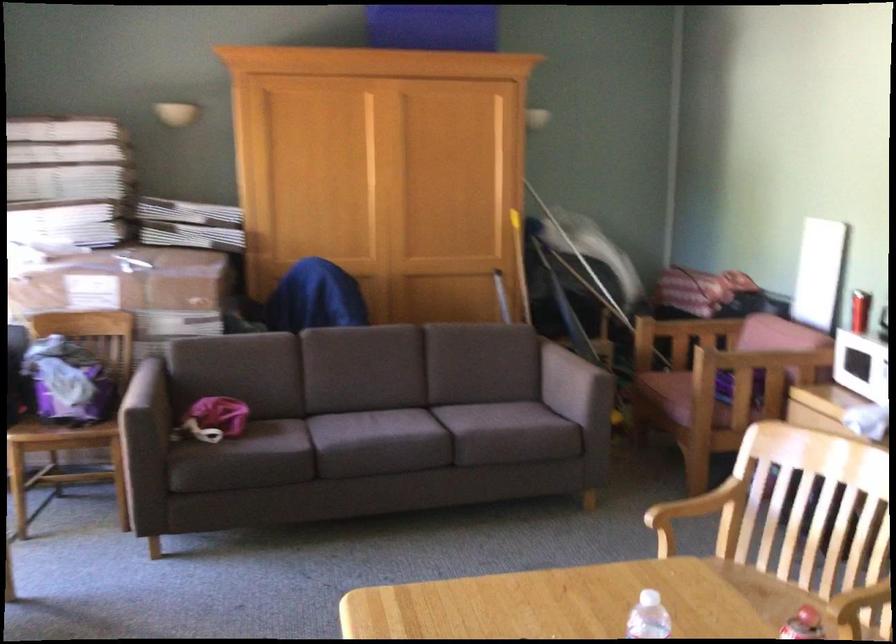
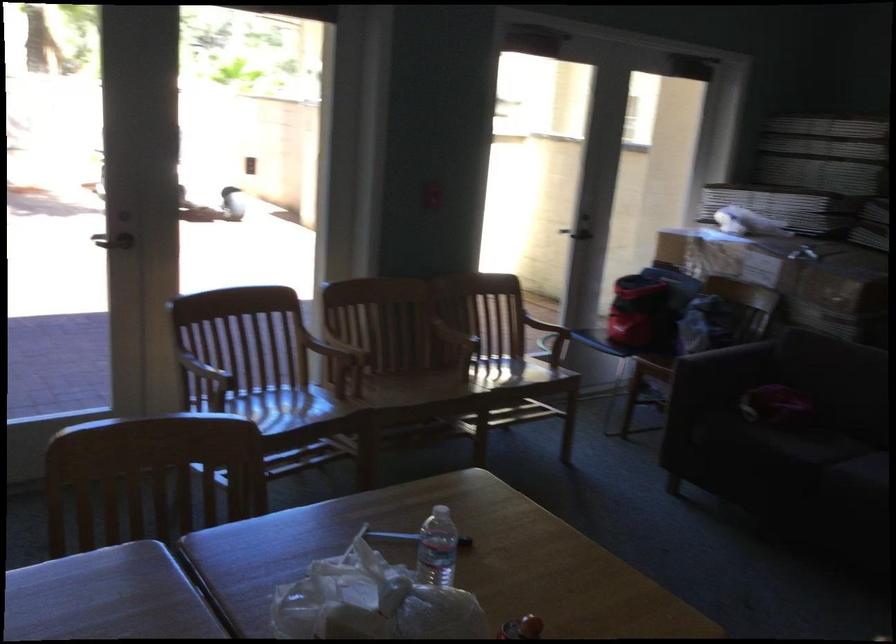
Question: I am providing you with two images of the same scene from different viewpoints. Which of the following objects are not visible in image2?

Choices:
 (A) clear water bottle
 (B) white appliance
 (C) sofa sitting surface
 (D) chair sitting surface

Answer: (A)